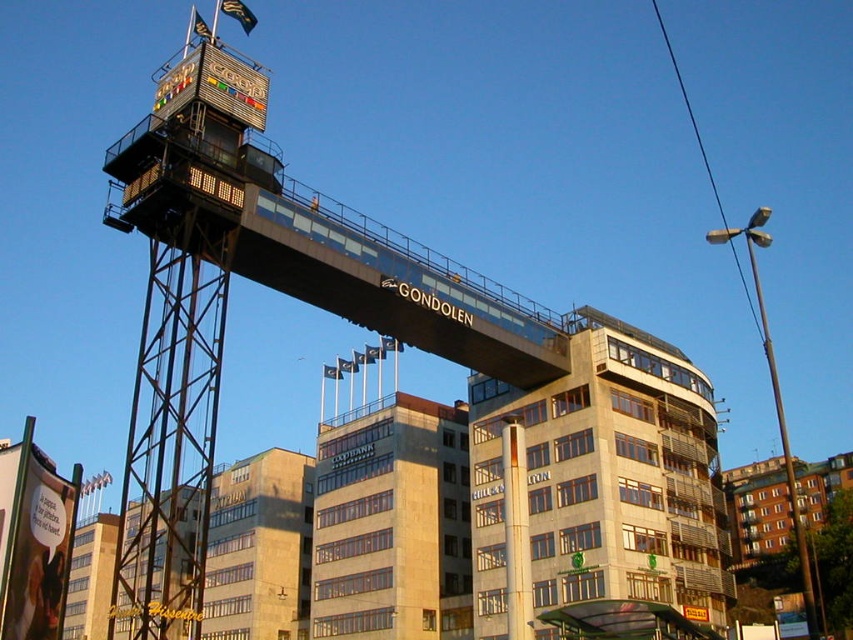
You are standing at the entrance of the Gondolen bridge and want to take a photo of the beige concrete building at center and beige stone building at center. Which building will appear larger in the photo?

The beige concrete building at center will appear larger in the photo because it is in front of the beige stone building at center, making it closer to the camera.

You are a city planner reviewing the urban layout of Gothenburg. You observe the beige concrete building at center and the beige stone building at center in the image of Gondolen bridge. Which of these two buildings is positioned higher in elevation relative to the ground level?

The beige concrete building at center is located above the beige stone building at center, meaning it has a higher elevation relative to the ground level.